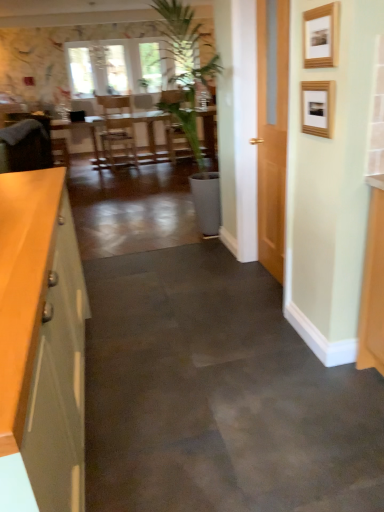
Question: Is matte gray cabinet at left wider than wooden picture frame at upper right, acting as the first picture frame starting from the bottom?

Choices:
 (A) yes
 (B) no

Answer: (A)

Question: Is matte gray cabinet at left closer to the viewer compared to wooden picture frame at upper right, which appears as the second picture frame when viewed from the top?

Choices:
 (A) no
 (B) yes

Answer: (B)

Question: Is matte gray cabinet at left taller than wooden picture frame at upper right, acting as the first picture frame starting from the bottom?

Choices:
 (A) no
 (B) yes

Answer: (B)

Question: Does matte gray cabinet at left come behind wooden picture frame at upper right, which appears as the second picture frame when viewed from the top?

Choices:
 (A) no
 (B) yes

Answer: (A)

Question: Is matte gray cabinet at left thinner than wooden picture frame at upper right, which appears as the second picture frame when viewed from the top?

Choices:
 (A) yes
 (B) no

Answer: (B)

Question: From the image's perspective, does matte gray cabinet at left appear lower than wooden picture frame at upper right, acting as the first picture frame starting from the bottom?

Choices:
 (A) no
 (B) yes

Answer: (B)

Question: Can you confirm if wooden picture frame at upper right, placed as the second picture frame when sorted from bottom to top, is smaller than wooden table at center?

Choices:
 (A) no
 (B) yes

Answer: (B)

Question: Could you tell me if wooden picture frame at upper right, acting as the first picture frame starting from the top, is facing wooden table at center?

Choices:
 (A) yes
 (B) no

Answer: (B)

Question: Is wooden picture frame at upper right, placed as the second picture frame when sorted from bottom to top, further to camera compared to wooden table at center?

Choices:
 (A) yes
 (B) no

Answer: (B)

Question: Considering the relative sizes of wooden picture frame at upper right, placed as the second picture frame when sorted from bottom to top, and wooden table at center in the image provided, is wooden picture frame at upper right, placed as the second picture frame when sorted from bottom to top, thinner than wooden table at center?

Choices:
 (A) no
 (B) yes

Answer: (B)

Question: Considering the relative sizes of wooden picture frame at upper right, acting as the first picture frame starting from the top, and wooden table at center in the image provided, is wooden picture frame at upper right, acting as the first picture frame starting from the top, wider than wooden table at center?

Choices:
 (A) no
 (B) yes

Answer: (A)

Question: Is wooden picture frame at upper right, acting as the first picture frame starting from the top, turned away from wooden table at center?

Choices:
 (A) no
 (B) yes

Answer: (A)

Question: Is matte gray cabinet at left located within velvet brown armchair at left?

Choices:
 (A) no
 (B) yes

Answer: (A)